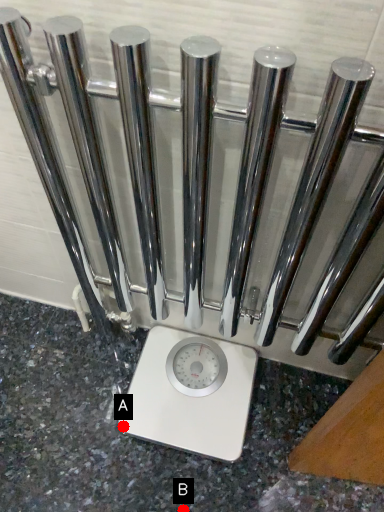
Question: Two points are circled on the image, labeled by A and B beside each circle. Which point appears farthest from the camera in this image?

Choices:
 (A) A is further
 (B) B is further

Answer: (A)